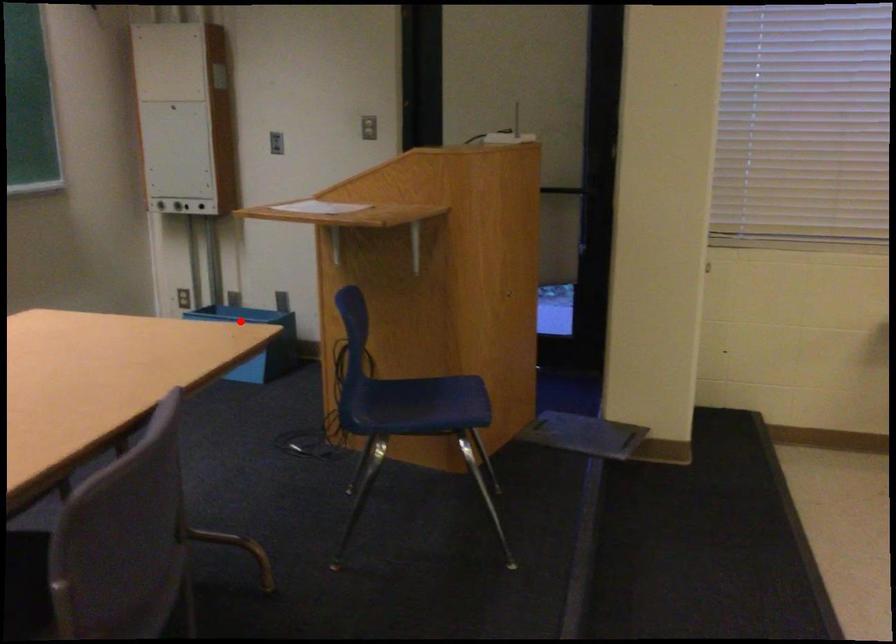
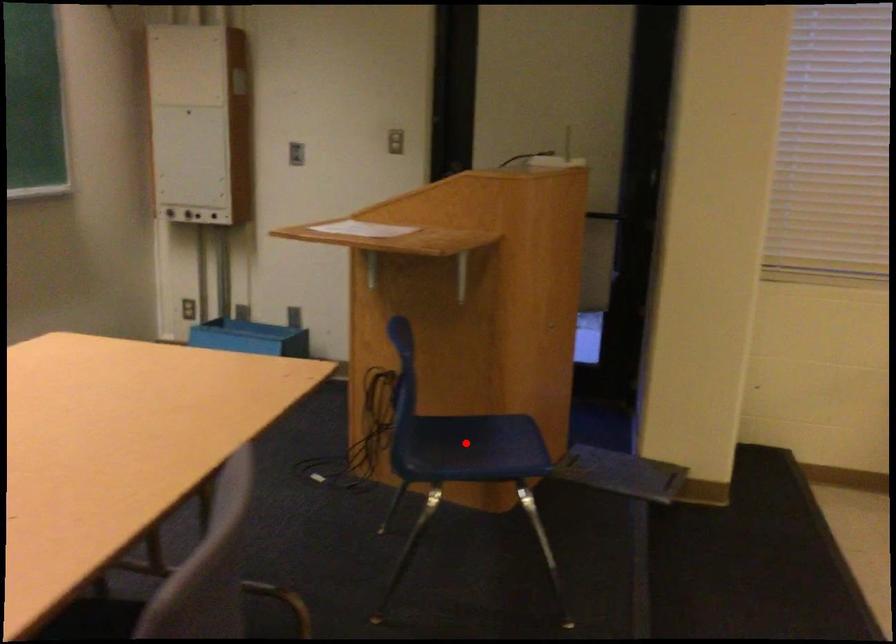
I am providing you with two images of the same scene from different viewpoints. A red point is marked on the first image and another point is marked on the second image. Does the point marked in image1 correspond to the same location as the one in image2?

No